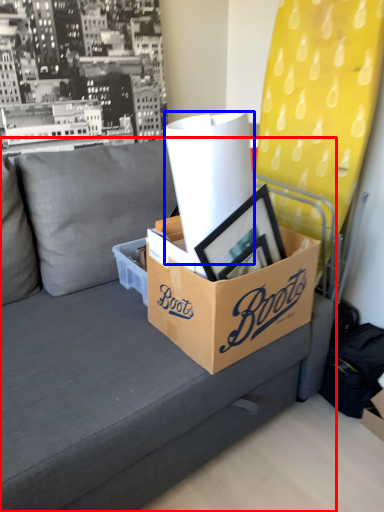
Question: Which object is closer to the camera taking this photo, studio couch (highlighted by a red box) or paper towel (highlighted by a blue box)?

Choices:
 (A) studio couch
 (B) paper towel

Answer: (A)